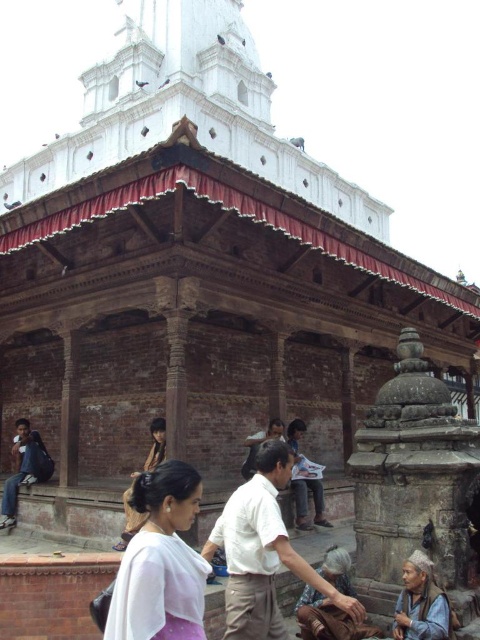
Question: Which is farther from the matte brown hair at lower center?

Choices:
 (A) brown leather bag at lower center
 (B) dark blue jeans at lower left

Answer: (A)

Question: Is white cotton shirt at center to the right of dark blue jeans at lower left from the viewer's perspective?

Choices:
 (A) yes
 (B) no

Answer: (A)

Question: Does white cotton shirt at center have a smaller size compared to matte brown hair at lower center?

Choices:
 (A) yes
 (B) no

Answer: (B)

Question: Considering the real-world distances, which object is farthest from the matte brown hair at lower center?

Choices:
 (A) white fabric at center
 (B) brown leather bag at lower center
 (C) dark brown wooden head at center
 (D) white paper at center

Answer: (B)

Question: Can you confirm if white paper at center is smaller than dark brown wooden head at center?

Choices:
 (A) no
 (B) yes

Answer: (A)

Question: Considering the real-world distances, which object is farthest from the matte brown hair at lower center?

Choices:
 (A) white paper at center
 (B) dark blue jeans at lower left
 (C) dark brown wooden head at center
 (D) brown leather bag at lower center

Answer: (D)